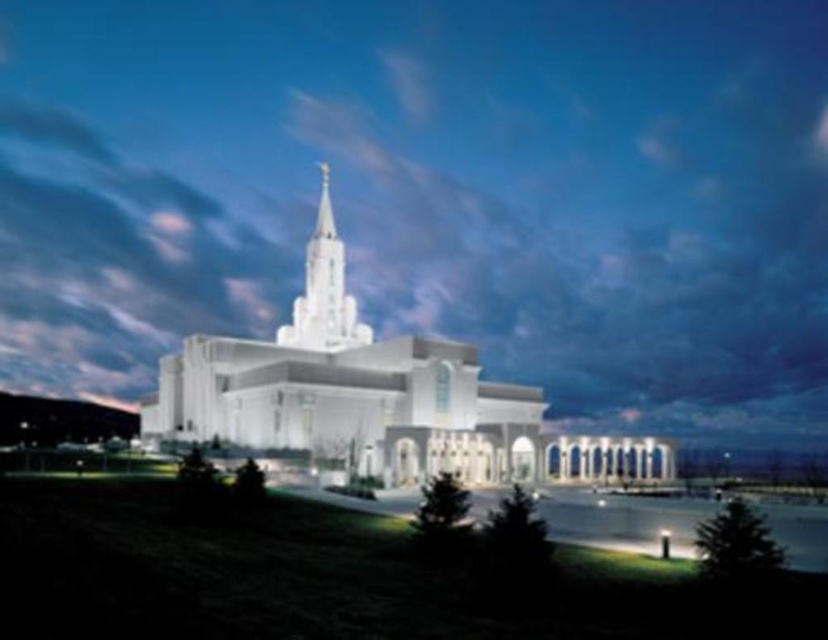
Question: Is white smooth church at center to the left of white stone spire at center from the viewer's perspective?

Choices:
 (A) no
 (B) yes

Answer: (A)

Question: Is white smooth church at center below white stone spire at center?

Choices:
 (A) yes
 (B) no

Answer: (A)

Question: Does white smooth church at center appear on the left side of white stone spire at center?

Choices:
 (A) yes
 (B) no

Answer: (B)

Question: Among these points, which one is nearest to the camera?

Choices:
 (A) (369, 326)
 (B) (306, 312)

Answer: (B)

Question: Which point is closer to the camera taking this photo?

Choices:
 (A) (348, 312)
 (B) (287, 342)

Answer: (B)